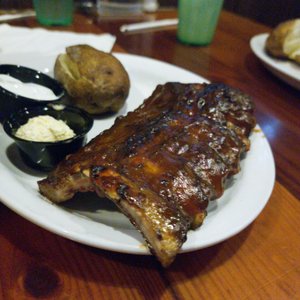
I want to click on white napkin, so click(x=39, y=40).